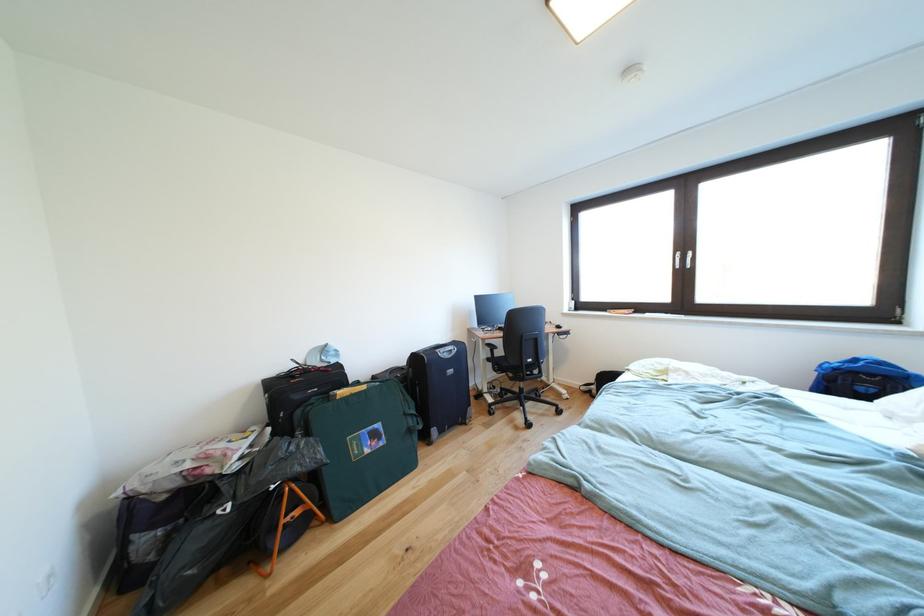
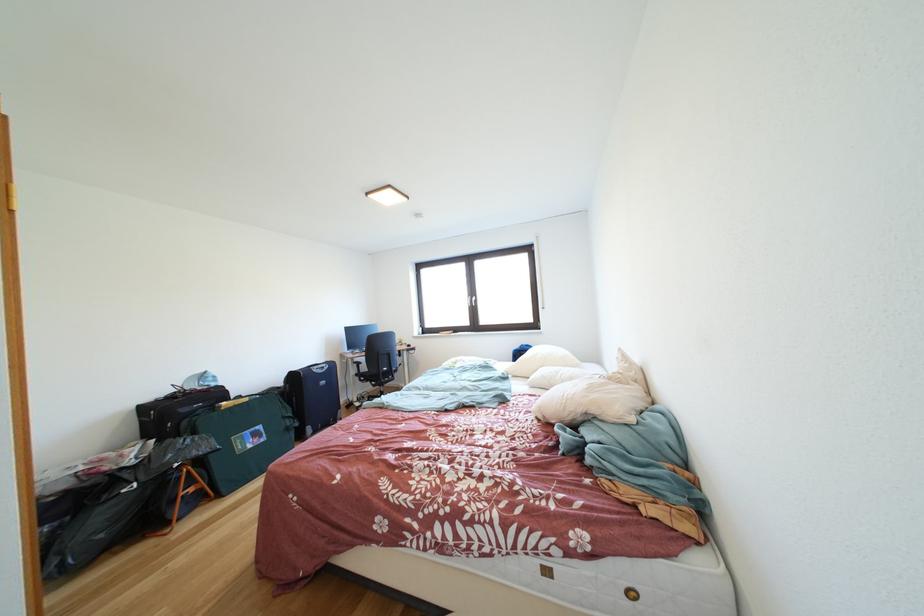
Locate, in the second image, the point that corresponds to (x=429, y=431) in the first image.

(306, 429)